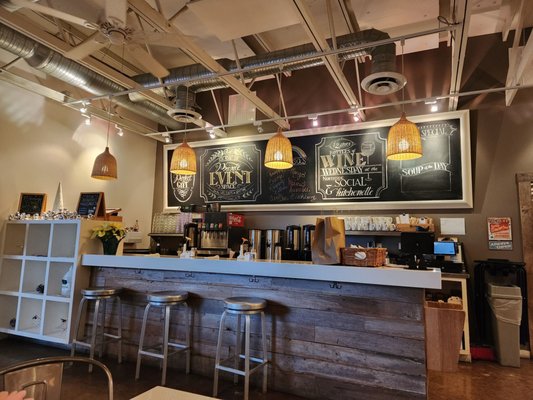
The height and width of the screenshot is (400, 533). In order to click on bar in this screenshot , I will do `click(227, 271)`.